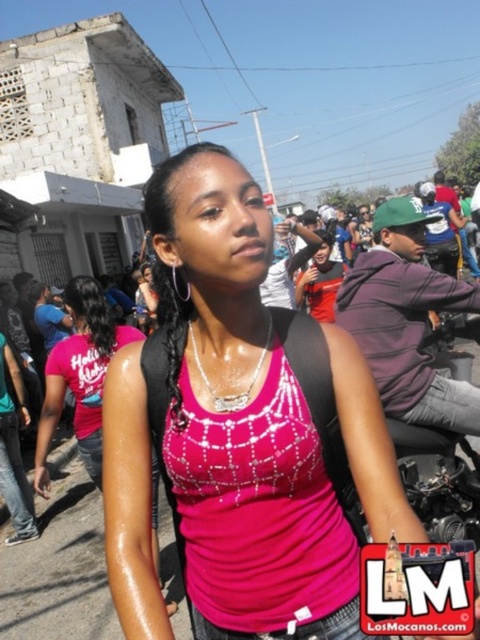
Question: Considering the real-world distances, which object is closest to the pink fabric tank top at center?

Choices:
 (A) purple fleece jacket at center
 (B) matte red shirt at center

Answer: (A)

Question: Is pink fabric tank top at center behind matte red shirt at center?

Choices:
 (A) yes
 (B) no

Answer: (B)

Question: Is purple fleece jacket at center closer to camera compared to matte red shirt at center?

Choices:
 (A) yes
 (B) no

Answer: (A)

Question: Among these points, which one is nearest to the camera?

Choices:
 (A) (315, 301)
 (B) (180, 403)

Answer: (B)

Question: Which of these objects is positioned closest to the pink fabric tank top at center?

Choices:
 (A) purple fleece jacket at center
 (B) matte red shirt at center

Answer: (A)

Question: Does pink fabric tank top at center lie in front of purple fleece jacket at center?

Choices:
 (A) yes
 (B) no

Answer: (A)